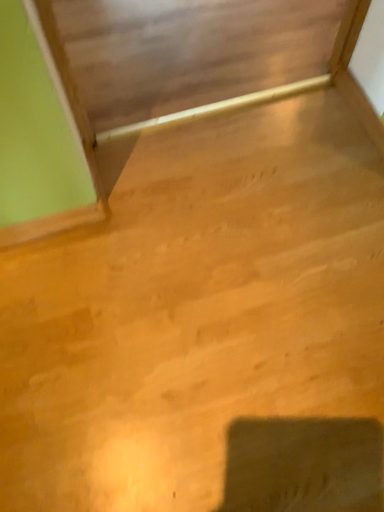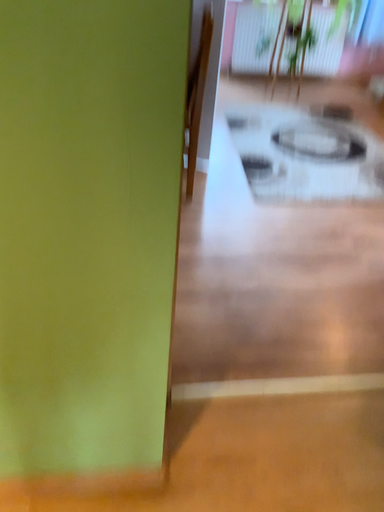
Question: How did the camera likely rotate when shooting the video?

Choices:
 (A) rotated downward
 (B) rotated upward

Answer: (B)